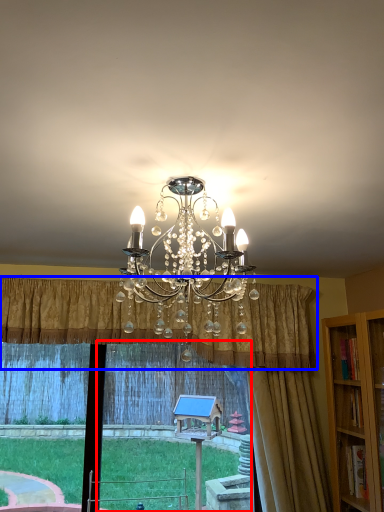
Question: Which object appears farthest to the camera in this image, window frame (highlighted by a red box) or curtain (highlighted by a blue box)?

Choices:
 (A) window frame
 (B) curtain

Answer: (A)